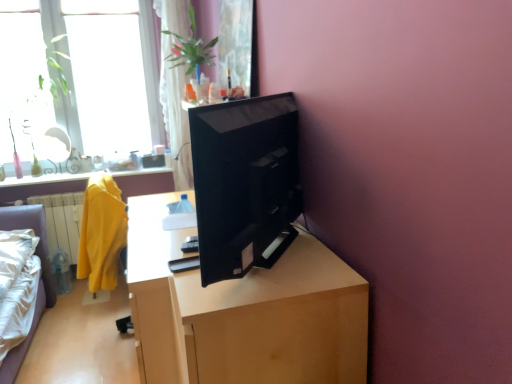
Question: Can you confirm if wooden desk at center is shorter than black glossy monitor at center?

Choices:
 (A) yes
 (B) no

Answer: (B)

Question: Is wooden desk at center positioned far away from black glossy monitor at center?

Choices:
 (A) yes
 (B) no

Answer: (B)

Question: Is wooden desk at center smaller than black glossy monitor at center?

Choices:
 (A) yes
 (B) no

Answer: (B)

Question: From a real-world perspective, does wooden desk at center stand above black glossy monitor at center?

Choices:
 (A) yes
 (B) no

Answer: (B)

Question: Does wooden desk at center have a greater width compared to black glossy monitor at center?

Choices:
 (A) no
 (B) yes

Answer: (B)

Question: Would you say black glossy monitor at center is to the left or to the right of transparent glass window at upper left in the picture?

Choices:
 (A) left
 (B) right

Answer: (B)

Question: Which is correct: black glossy monitor at center is inside transparent glass window at upper left, or outside of it?

Choices:
 (A) outside
 (B) inside

Answer: (A)

Question: Looking at their shapes, would you say black glossy monitor at center is wider or thinner than transparent glass window at upper left?

Choices:
 (A) thin
 (B) wide

Answer: (B)

Question: In terms of height, does black glossy monitor at center look taller or shorter compared to transparent glass window at upper left?

Choices:
 (A) tall
 (B) short

Answer: (B)

Question: From a real-world perspective, is matte yellow robe at left above or below black glossy monitor at center?

Choices:
 (A) above
 (B) below

Answer: (B)

Question: Based on their sizes in the image, would you say matte yellow robe at left is bigger or smaller than black glossy monitor at center?

Choices:
 (A) small
 (B) big

Answer: (B)

Question: In the image, is matte yellow robe at left positioned in front of or behind black glossy monitor at center?

Choices:
 (A) front
 (B) behind

Answer: (B)

Question: From the image's perspective, is matte yellow robe at left positioned above or below black glossy monitor at center?

Choices:
 (A) above
 (B) below

Answer: (B)

Question: Do you think wooden desk at center is within matte yellow robe at left, or outside of it?

Choices:
 (A) inside
 (B) outside

Answer: (B)

Question: From a real-world perspective, is wooden desk at center physically located above or below matte yellow robe at left?

Choices:
 (A) above
 (B) below

Answer: (B)